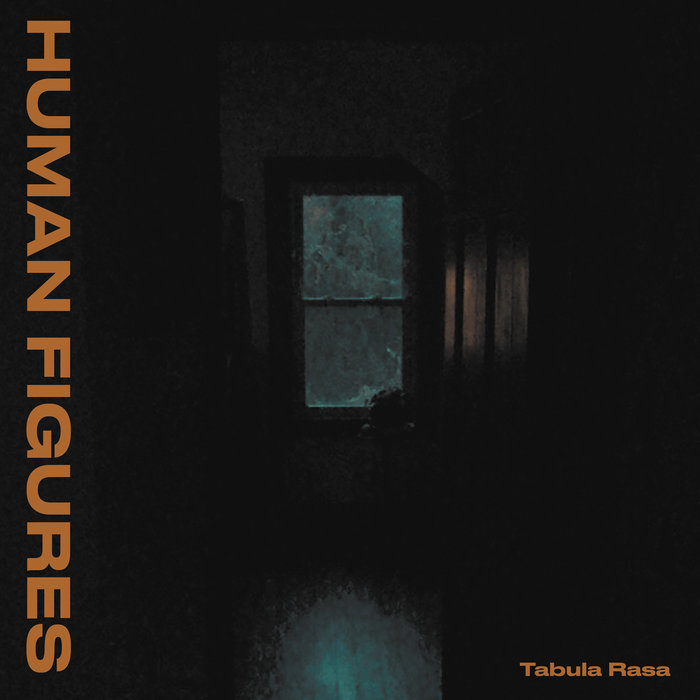
Locate an element on the screen. Image resolution: width=700 pixels, height=700 pixels. window is located at coordinates (351, 357), (348, 257).